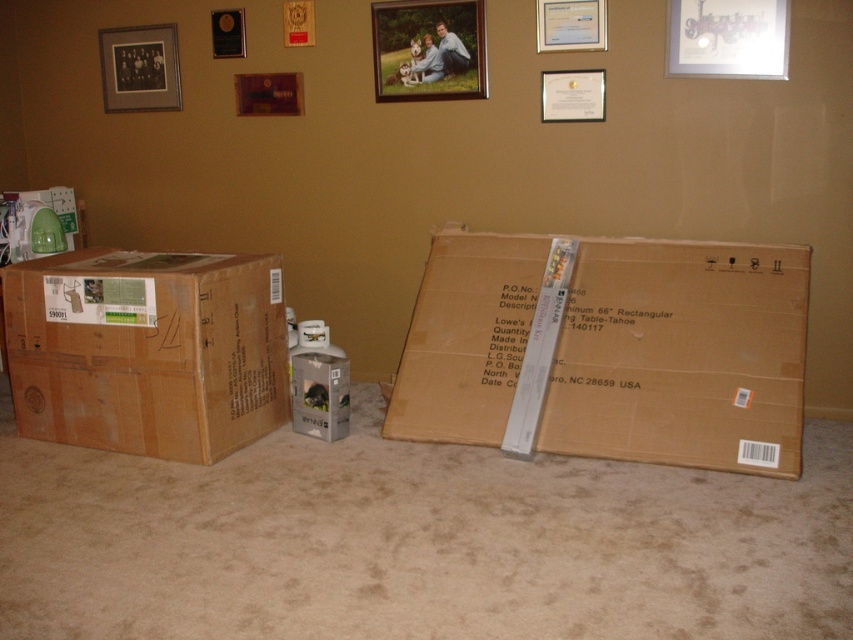
Which is in front, point (154, 49) or point (566, 42)?

Point (566, 42)

Is black matte picture frame at upper left taller than matte silver picture frame at upper center?

Correct, black matte picture frame at upper left is much taller as matte silver picture frame at upper center.

Where is `black matte picture frame at upper left`? black matte picture frame at upper left is located at coordinates (138, 68).

This screenshot has width=853, height=640. What are the coordinates of `black matte picture frame at upper left` in the screenshot? It's located at [138, 68].

Is the position of brown cardboard box at left less distant than that of matte cardboard box at center?

Yes.

Between brown cardboard box at left and matte cardboard box at center, which one has less height?

matte cardboard box at center is shorter.

Between point (137, 381) and point (318, 412), which one is positioned behind?

The point (318, 412) is behind.

You are a GUI agent. You are given a task and a screenshot of the screen. Output one action in this format:
    pyautogui.click(x=<x>, y=<y>)
    Task: Click on the brown cardboard box at left
    Image resolution: width=853 pixels, height=640 pixels.
    Given the screenshot: What is the action you would take?
    pyautogui.click(x=148, y=349)

Is brown cardboard box at center wider than matte silver picture frame at upper center?

Correct, the width of brown cardboard box at center exceeds that of matte silver picture frame at upper center.

Which of these two, brown cardboard box at center or matte silver picture frame at upper center, stands shorter?

With less height is matte silver picture frame at upper center.

Is point (485, 440) closer to viewer compared to point (596, 38)?

Yes, it is.

Locate an element on the screen. The height and width of the screenshot is (640, 853). brown cardboard box at center is located at coordinates (682, 355).